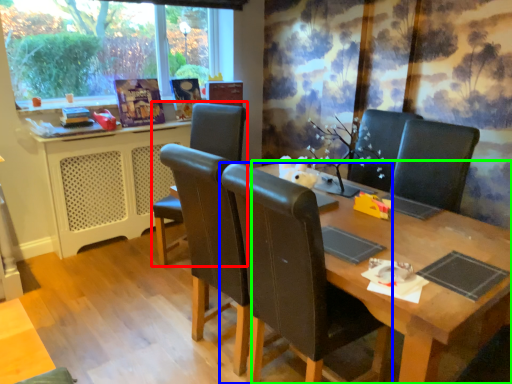
Question: Which object is the farthest from chair (highlighted by a red box)? Choose among these: chair (highlighted by a blue box) or table (highlighted by a green box).

Choices:
 (A) chair
 (B) table

Answer: (B)